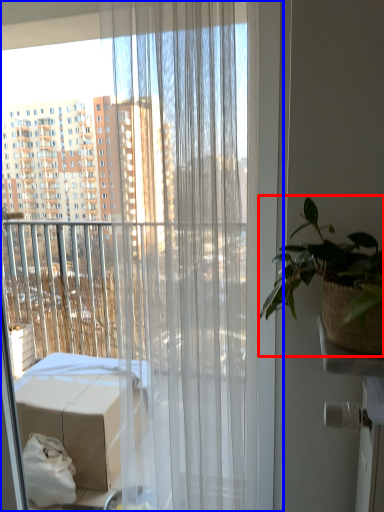
Question: Which object appears closest to the camera in this image, houseplant (highlighted by a red box) or curtain (highlighted by a blue box)?

Choices:
 (A) houseplant
 (B) curtain

Answer: (A)